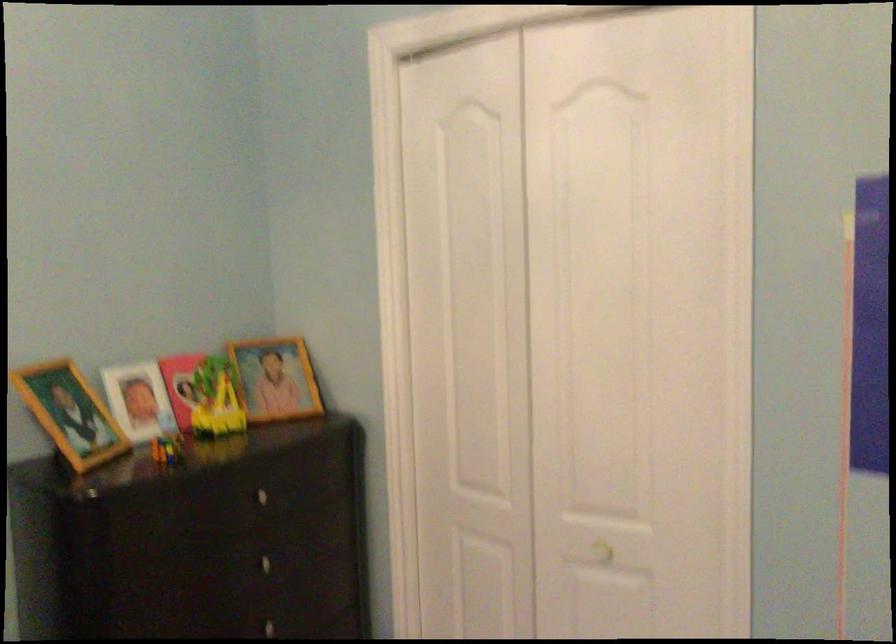
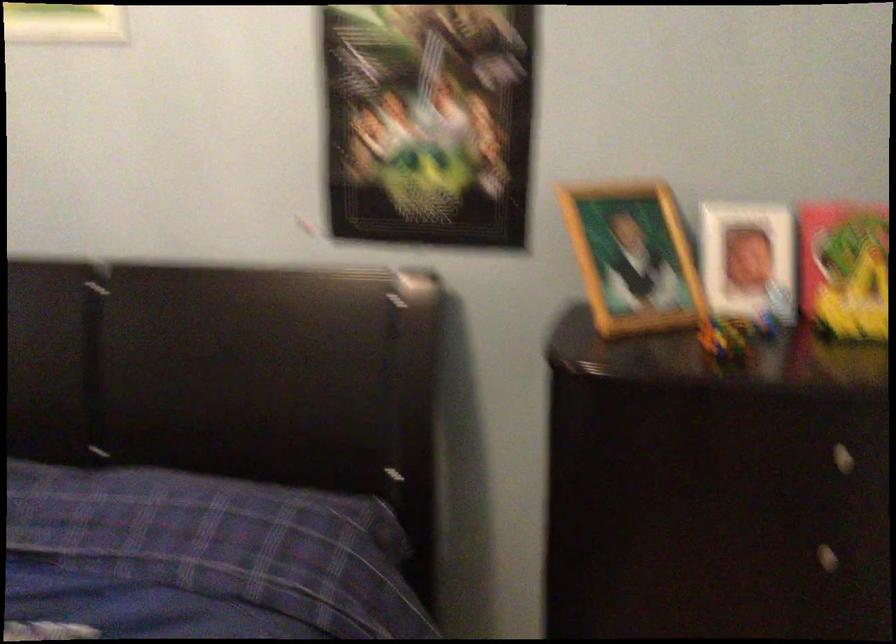
Locate, in the second image, the point that corresponds to point 141,401 in the first image.

(748, 261)